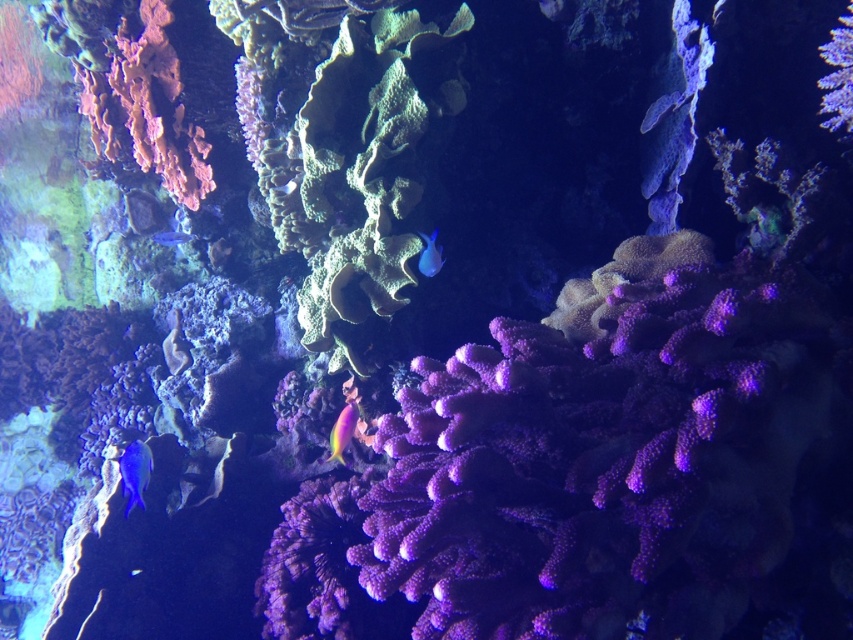
Does matte blue fish at lower left have a greater width compared to blue glossy fish at left?

In fact, matte blue fish at lower left might be narrower than blue glossy fish at left.

Is point (143, 488) less distant than point (160, 243)?

Yes, point (143, 488) is in front of point (160, 243).

Is point (123, 484) in front of point (178, 241)?

Yes, it is.

At what (x,y) coordinates should I click in order to perform the action: click on matte blue fish at lower left. Please return your answer as a coordinate pair (x, y). Looking at the image, I should click on (134, 472).

Can you confirm if shiny pink coral at center is thinner than blue glossy fish at center?

Indeed, shiny pink coral at center has a lesser width compared to blue glossy fish at center.

Is shiny pink coral at center below blue glossy fish at center?

Yes, shiny pink coral at center is below blue glossy fish at center.

Is point (347, 424) farther from camera compared to point (428, 248)?

No, it is in front of (428, 248).

This screenshot has width=853, height=640. I want to click on shiny pink coral at center, so click(x=341, y=432).

Between shiny pink coral at center and shiny blue fish at upper right, which one appears on the left side from the viewer's perspective?

From the viewer's perspective, shiny pink coral at center appears more on the left side.

Does shiny pink coral at center have a greater height compared to shiny blue fish at upper right?

Correct, shiny pink coral at center is much taller as shiny blue fish at upper right.

Does point (357, 403) lie behind point (682, 100)?

Yes, point (357, 403) is farther from viewer.

Identify the location of shiny pink coral at center. (341, 432).